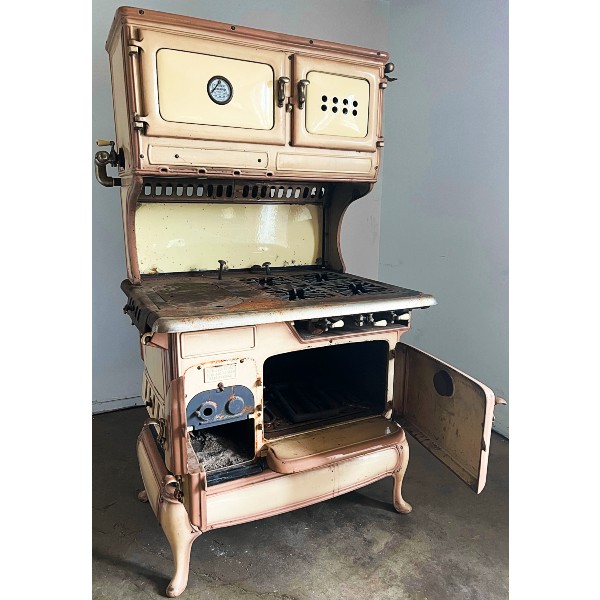
Locate an element on the screen. stove is located at coordinates [323, 290].